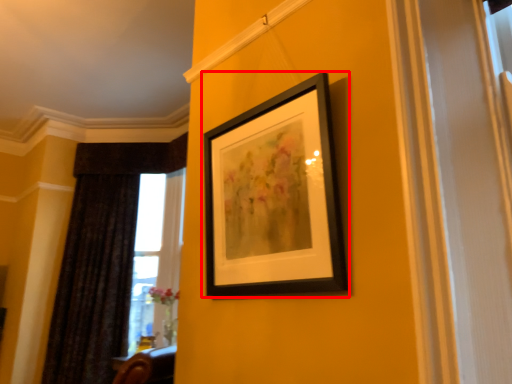
Question: Where is picture frame (annotated by the red box) located in relation to curtain in the image?

Choices:
 (A) right
 (B) left

Answer: (A)